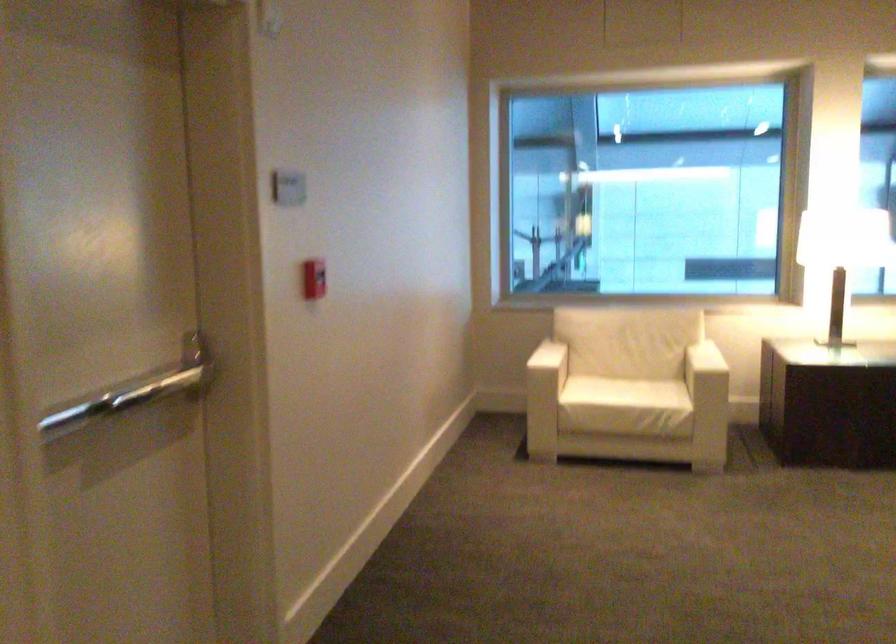
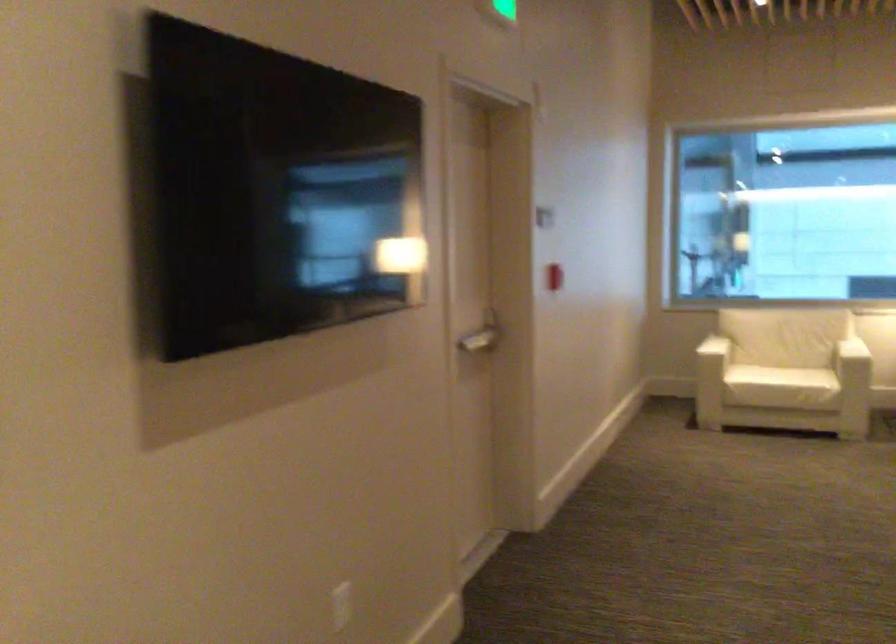
The point at (x=276, y=222) is marked in the first image. Where is the corresponding point in the second image?

(544, 216)